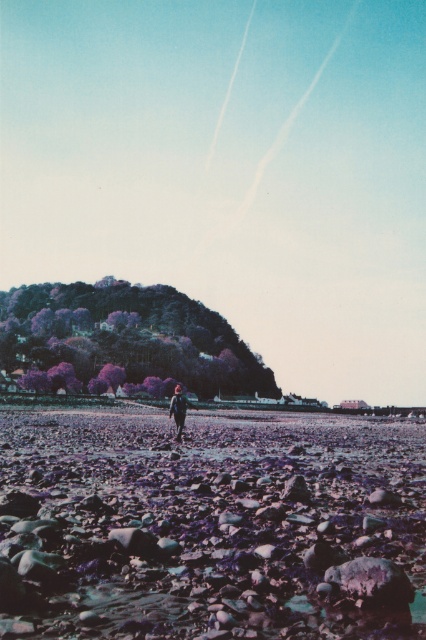
You are standing on the beach and want to take a photo of both point [28,586] and point [178,428] in the scene. Which point should you focus on first to ensure both are in sharp focus?

You should focus on point [28,586] first because it is closer to the camera than point [178,428], ensuring both points are within the depth of field.

You are a photographer wanting to capture both the purple gravel beach at center and the dark blue fabric at center in a single frame. Which object will occupy more space in your photo?

The purple gravel beach at center is larger in size than the dark blue fabric at center, so it will occupy more space in the photo.